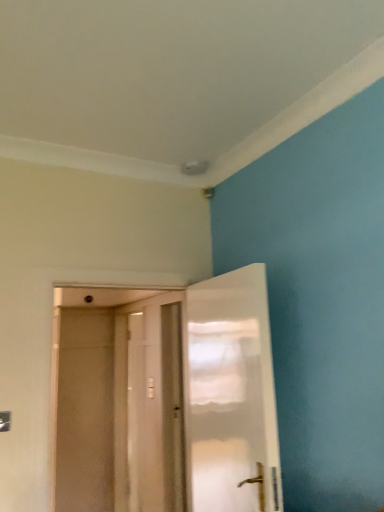
Question: Considering the relative sizes of white glossy door at center, which is the 2th door in front-to-back order, and transparent plastic screen door at center in the image provided, is white glossy door at center, which is the 2th door in front-to-back order, smaller than transparent plastic screen door at center?

Choices:
 (A) yes
 (B) no

Answer: (B)

Question: Considering the relative sizes of white glossy door at center, which is the 2th door in front-to-back order, and transparent plastic screen door at center in the image provided, is white glossy door at center, which is the 2th door in front-to-back order, bigger than transparent plastic screen door at center?

Choices:
 (A) no
 (B) yes

Answer: (B)

Question: Is white glossy door at center, which is counted as the 1th door, starting from the back, looking in the opposite direction of transparent plastic screen door at center?

Choices:
 (A) yes
 (B) no

Answer: (B)

Question: Can you confirm if white glossy door at center, which is the 2th door in front-to-back order, is positioned to the right of transparent plastic screen door at center?

Choices:
 (A) yes
 (B) no

Answer: (A)

Question: From the image's perspective, would you say white glossy door at center, which is the 2th door in front-to-back order, is positioned over transparent plastic screen door at center?

Choices:
 (A) no
 (B) yes

Answer: (B)

Question: Is point (150, 487) closer or farther from the camera than point (142, 409)?

Choices:
 (A) closer
 (B) farther

Answer: (A)

Question: Would you say white glossy door at center, which is counted as the 1th door, starting from the back, is to the left or to the right of white matte door at center, the second door positioned from the back, in the picture?

Choices:
 (A) left
 (B) right

Answer: (A)

Question: Which is correct: white glossy door at center, which is the 2th door in front-to-back order, is inside white matte door at center, the second door positioned from the back, or outside of it?

Choices:
 (A) outside
 (B) inside

Answer: (A)

Question: In terms of height, does white glossy door at center, which is the 2th door in front-to-back order, look taller or shorter compared to white matte door at center, the second door positioned from the back?

Choices:
 (A) tall
 (B) short

Answer: (A)

Question: Looking at their shapes, would you say transparent plastic screen door at center is wider or thinner than white matte door at center, acting as the 1th door starting from the front?

Choices:
 (A) wide
 (B) thin

Answer: (B)

Question: Considering their positions, is transparent plastic screen door at center located in front of or behind white matte door at center, the second door positioned from the back?

Choices:
 (A) behind
 (B) front

Answer: (A)

Question: Looking at the image, does transparent plastic screen door at center seem bigger or smaller compared to white matte door at center, the second door positioned from the back?

Choices:
 (A) small
 (B) big

Answer: (A)

Question: Visually, is transparent plastic screen door at center positioned to the left or to the right of white matte door at center, acting as the 1th door starting from the front?

Choices:
 (A) left
 (B) right

Answer: (A)

Question: From a real-world perspective, relative to white glossy door at center, which is counted as the 1th door, starting from the back, is transparent plastic screen door at center vertically above or below?

Choices:
 (A) above
 (B) below

Answer: (A)

Question: Considering their positions, is transparent plastic screen door at center located in front of or behind white glossy door at center, which is the 2th door in front-to-back order?

Choices:
 (A) behind
 (B) front

Answer: (A)